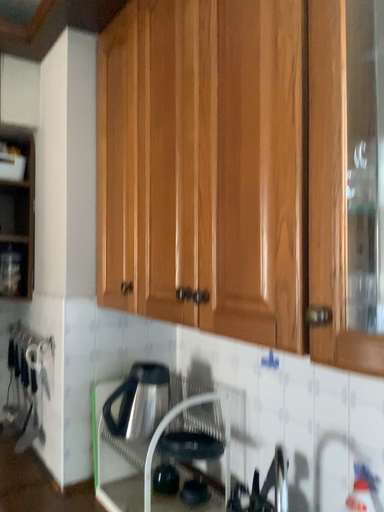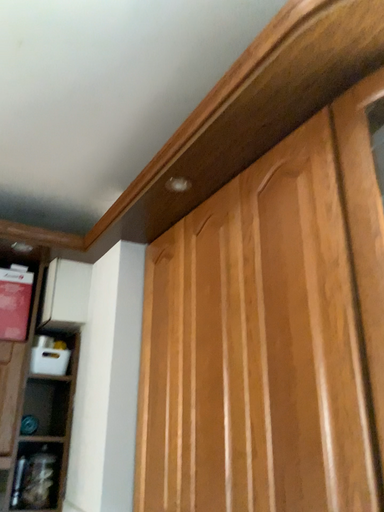
Question: How did the camera likely rotate when shooting the video?

Choices:
 (A) rotated upward
 (B) rotated downward

Answer: (A)